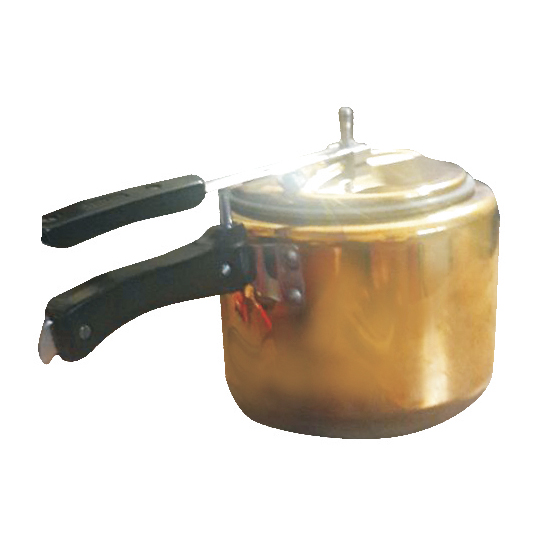
Image resolution: width=540 pixels, height=540 pixels. I want to click on the bottom of pot, so click(x=368, y=432).